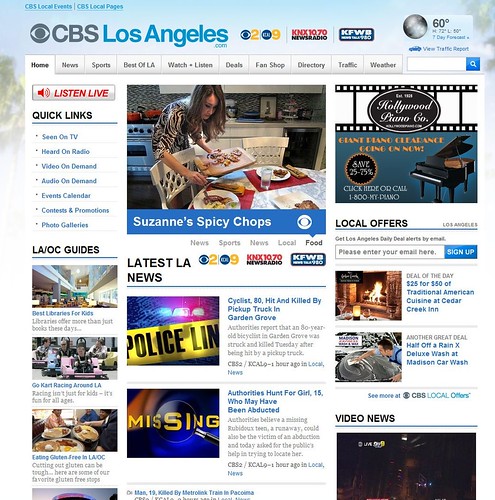
Image resolution: width=495 pixels, height=500 pixels. In order to click on bluish silver stove in this screenshot , I will do pos(137,157).